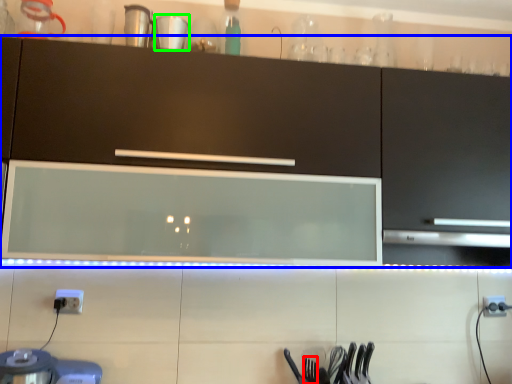
Question: Which object is the farthest from silverware (highlighted by a red box)? Choose among these: cabinetry (highlighted by a blue box) or tableware (highlighted by a green box).

Choices:
 (A) cabinetry
 (B) tableware

Answer: (B)